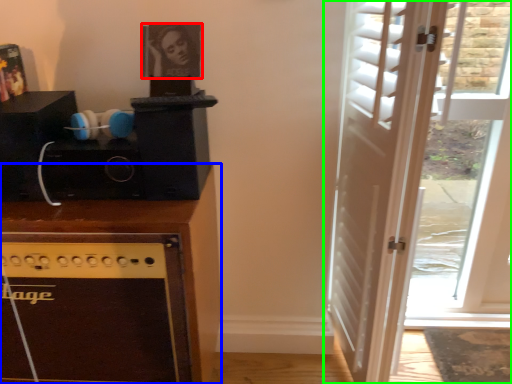
Question: Considering the real-world distances, which object is closest to picture frame (highlighted by a red box)? cabinetry (highlighted by a blue box) or door (highlighted by a green box).

Choices:
 (A) cabinetry
 (B) door

Answer: (A)